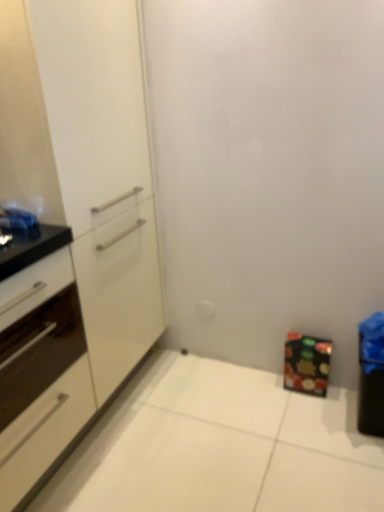
Question: From the image's perspective, is white glossy cabinet at left, which is counted as the 3th cabinetry, starting from the right, beneath matte black cabinet at lower right, the first cabinetry viewed from the right?

Choices:
 (A) yes
 (B) no

Answer: (B)

Question: Is white glossy cabinet at left, which is counted as the 3th cabinetry, starting from the right, located outside matte black cabinet at lower right, the first cabinetry viewed from the right?

Choices:
 (A) yes
 (B) no

Answer: (A)

Question: Is white glossy cabinet at left, marked as the 1th cabinetry in a left-to-right arrangement, at the right side of matte black cabinet at lower right, which appears as the 3th cabinetry when viewed from the left?

Choices:
 (A) yes
 (B) no

Answer: (B)

Question: Is white glossy cabinet at left, which is counted as the 3th cabinetry, starting from the right, at the left side of matte black cabinet at lower right, the first cabinetry viewed from the right?

Choices:
 (A) yes
 (B) no

Answer: (A)

Question: From the image's perspective, does white glossy cabinet at left, marked as the 1th cabinetry in a left-to-right arrangement, appear higher than matte black cabinet at lower right, the first cabinetry viewed from the right?

Choices:
 (A) yes
 (B) no

Answer: (A)

Question: In terms of width, does white glossy cabinet at left, the second cabinetry positioned from the right, look wider or thinner when compared to matte black cabinet at lower right, which appears as the 3th cabinetry when viewed from the left?

Choices:
 (A) thin
 (B) wide

Answer: (A)

Question: Based on their sizes in the image, would you say white glossy cabinet at left, the second cabinetry positioned from the right, is bigger or smaller than matte black cabinet at lower right, the first cabinetry viewed from the right?

Choices:
 (A) big
 (B) small

Answer: (A)

Question: From the image's perspective, is white glossy cabinet at left, the second cabinetry positioned from the right, above or below matte black cabinet at lower right, the first cabinetry viewed from the right?

Choices:
 (A) below
 (B) above

Answer: (B)

Question: Is point (26, 129) positioned closer to the camera than point (296, 354)?

Choices:
 (A) closer
 (B) farther

Answer: (A)

Question: Based on their sizes in the image, would you say white glossy cabinet at left, marked as the 2th cabinetry in a left-to-right arrangement, is bigger or smaller than white glossy cabinet at left, marked as the 1th cabinetry in a left-to-right arrangement?

Choices:
 (A) small
 (B) big

Answer: (A)

Question: Is white glossy cabinet at left, marked as the 2th cabinetry in a left-to-right arrangement, wider or thinner than white glossy cabinet at left, marked as the 1th cabinetry in a left-to-right arrangement?

Choices:
 (A) wide
 (B) thin

Answer: (B)

Question: From their relative heights in the image, would you say white glossy cabinet at left, marked as the 2th cabinetry in a left-to-right arrangement, is taller or shorter than white glossy cabinet at left, which is counted as the 3th cabinetry, starting from the right?

Choices:
 (A) short
 (B) tall

Answer: (B)

Question: Is white glossy cabinet at left, marked as the 2th cabinetry in a left-to-right arrangement, situated inside white glossy cabinet at left, which is counted as the 3th cabinetry, starting from the right, or outside?

Choices:
 (A) outside
 (B) inside

Answer: (A)

Question: In the image, is matte black cabinet at lower right, the first cabinetry viewed from the right, positioned in front of or behind white glossy cabinet at left, marked as the 2th cabinetry in a left-to-right arrangement?

Choices:
 (A) front
 (B) behind

Answer: (B)

Question: From a real-world perspective, is matte black cabinet at lower right, the first cabinetry viewed from the right, physically located above or below white glossy cabinet at left, marked as the 2th cabinetry in a left-to-right arrangement?

Choices:
 (A) above
 (B) below

Answer: (B)